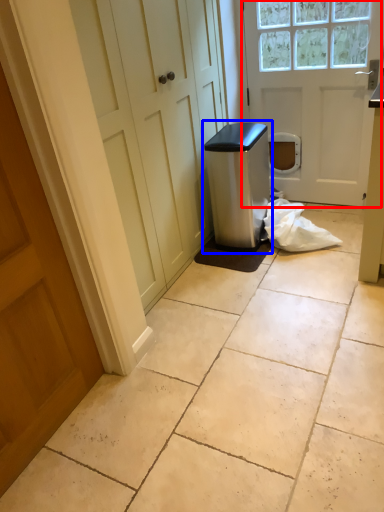
Question: Which object is further to the camera taking this photo, door (highlighted by a red box) or water cooler (highlighted by a blue box)?

Choices:
 (A) door
 (B) water cooler

Answer: (B)